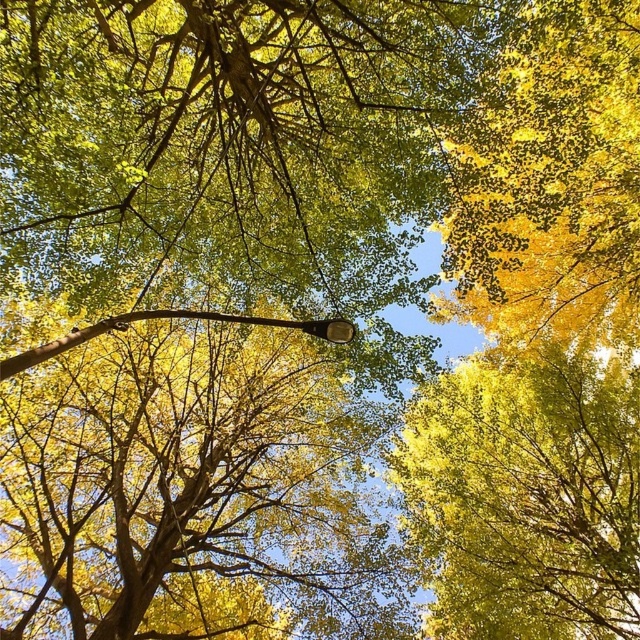
You are standing in a park with a streetlamp in front of you. There is a point marked at coordinates (188, 486). Which object does this point correspond to?

The point corresponds to the smooth brown tree trunk at center.

You are standing in the autumn scene looking up at the trees. If you want to find the smooth brown tree trunk at center, where would you look?

The smooth brown tree trunk at center is located at the coordinates point (188, 486).